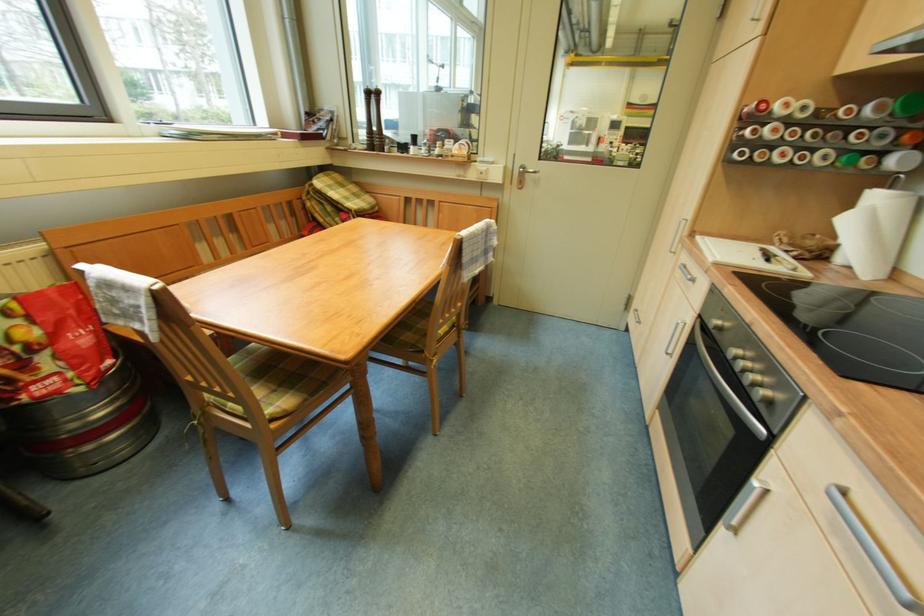
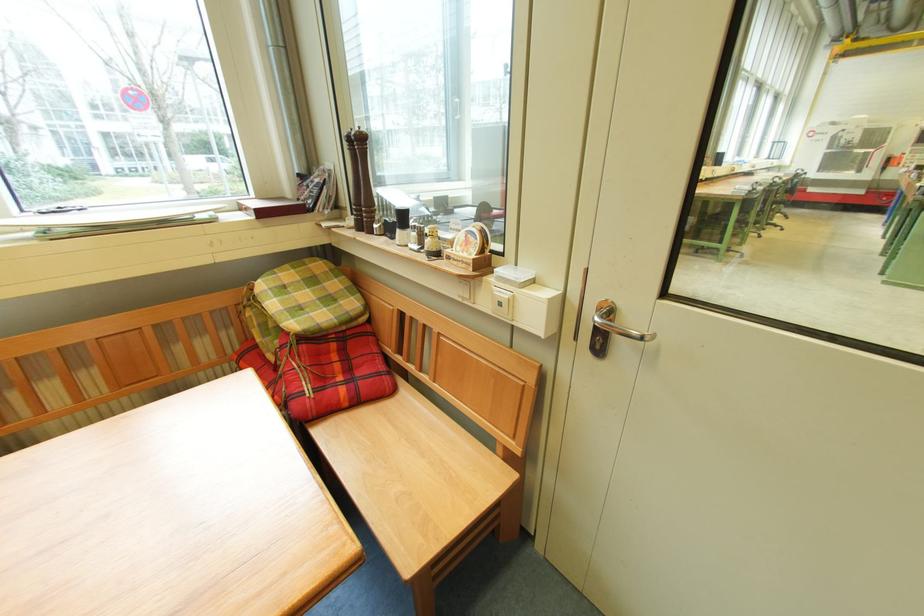
Where in the second image is the point corresponding to [345,222] from the first image?

(285, 344)